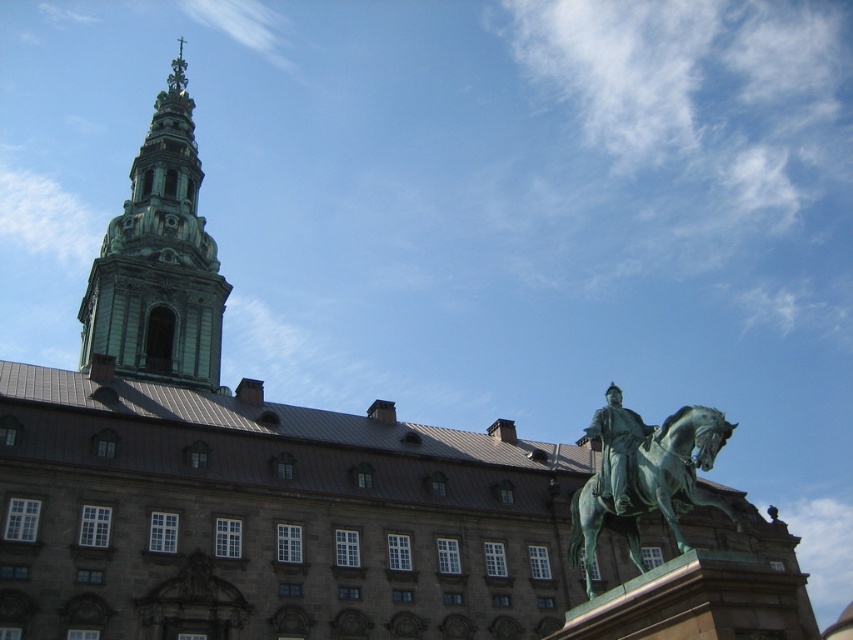
Question: Which of these objects is positioned farthest from the green polished metal horse at center?

Choices:
 (A) green stone tower at upper left
 (B) green polished bronze statue at right

Answer: (A)

Question: From the image, what is the correct spatial relationship of green stone tower at upper left in relation to green polished bronze statue at right?

Choices:
 (A) left
 (B) right

Answer: (A)

Question: Considering the relative positions of green polished metal horse at center and green polished bronze statue at right in the image provided, where is green polished metal horse at center located with respect to green polished bronze statue at right?

Choices:
 (A) left
 (B) right

Answer: (A)

Question: Which object is positioned farthest from the green polished metal horse at center?

Choices:
 (A) green stone tower at upper left
 (B) green polished bronze statue at right

Answer: (A)

Question: Which of these objects is positioned closest to the green polished metal horse at center?

Choices:
 (A) green polished bronze statue at right
 (B) green stone tower at upper left

Answer: (A)

Question: From the image, what is the correct spatial relationship of green stone tower at upper left in relation to green polished bronze statue at right?

Choices:
 (A) above
 (B) below

Answer: (A)